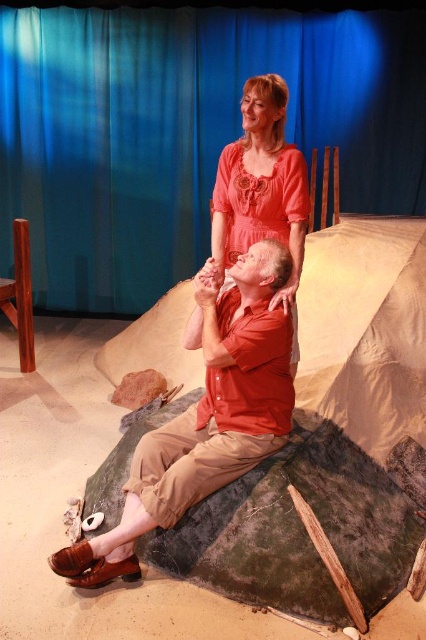
You are an audience member sitting in the front row of the theater. You notice the matte red shirt at center and the matte orange dress at upper center. Which of these two items is positioned closer to you?

The matte red shirt at center is closer to the viewer than the matte orange dress at upper center.

Based on the coordinates provided, which object is located at point (206, 419)?

The point (206, 419) marks the location of the matte red shirt at center.

You are an actor in a play and need to exit the stage quickly. You see the blue fabric curtain at upper center and the matte red shirt at center. Which object should you move towards to exit the stage?

You should move towards the blue fabric curtain at upper center because it is positioned to the left of the matte red shirt at center, which is typically where stage exits are located.